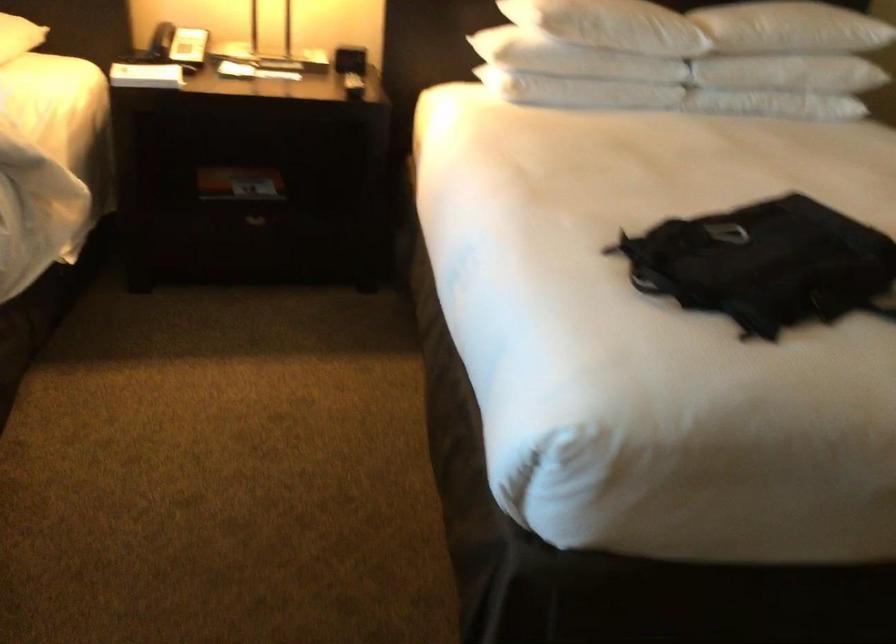
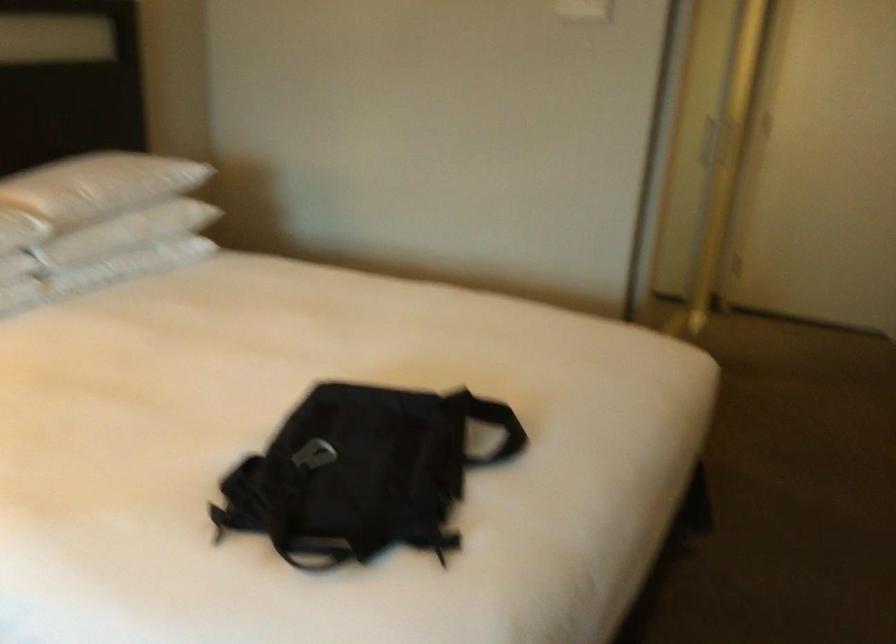
Question: How did the camera likely rotate?

Choices:
 (A) Left
 (B) Right
 (C) Up
 (D) Down

Answer: (B)